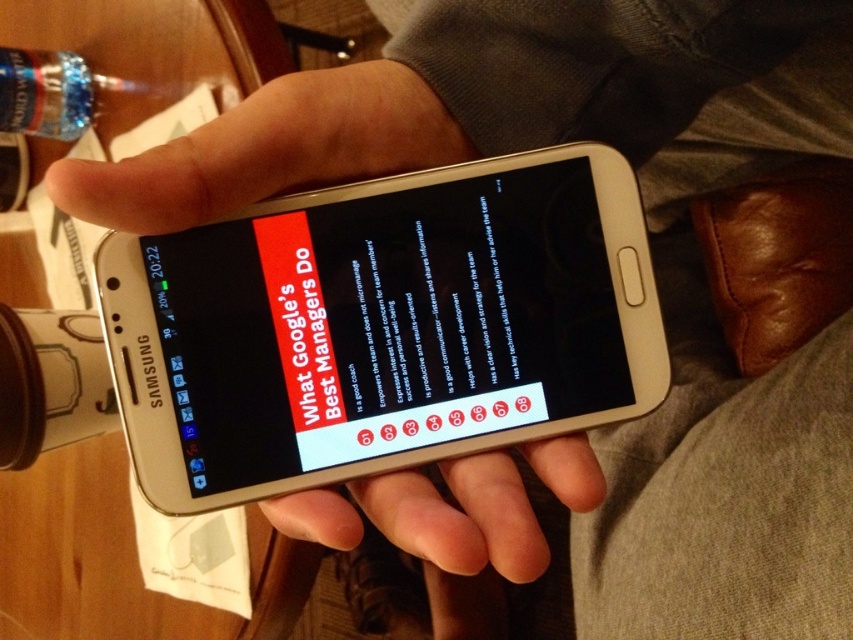
You are a photographer trying to capture a closeup of the Samsung smartphone screen displayed in the image. The point you need to focus on is at coordinates point (430, 378). Given that the point and the camera are 15.92 inches apart, can you determine if this distance is within the minimum focusing distance of your lens, which is 12 inches?

The point (430, 378) and the camera are 15.92 inches apart. Since the minimum focusing distance of the lens is 12 inches, the photographer can focus on the point because the distance is greater than the minimum requirement.

In the scene shown: You are organizing a meeting and need to check the agenda displayed on the Samsung smartphone. However, there is a clear plastic bottle at upper left blocking your view. Can you move the black glossy text message at center to the left to see the agenda better?

The black glossy text message at center is positioned on the right side of the clear plastic bottle at upper left. Moving it to the left would place it behind the bottle, further obstructing the view of the agenda.